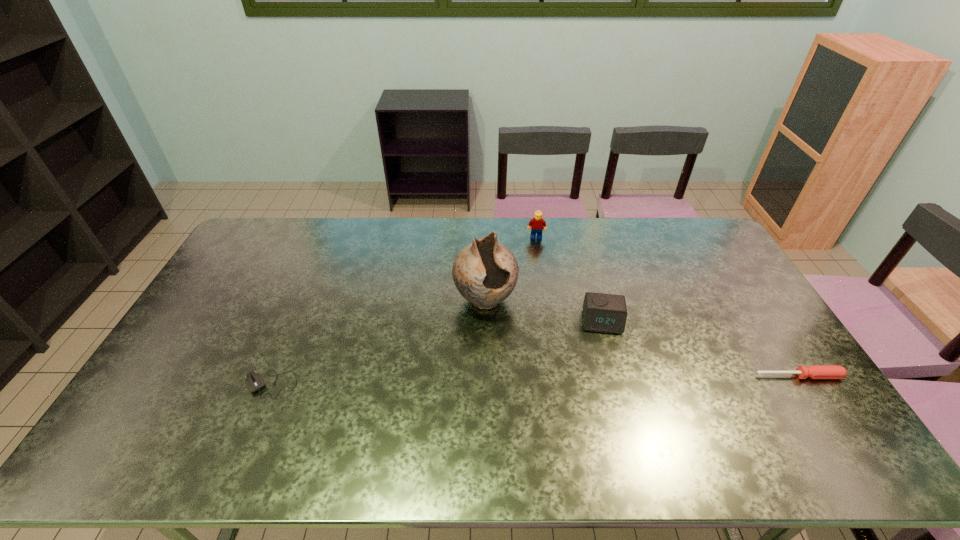
Identify which object is located as the second nearest to the second shortest object. Please provide its 2D coordinates. Your answer should be formatted as a tuple, i.e. [(x, y)], where the tuple contains the x and y coordinates of a point satisfying the conditions above.

[(485, 272)]

I want to click on free location that satisfies the following two spatial constraints: 1. on the back side of the leftmost object; 2. on the left side of the tallest object, so click(x=305, y=300).